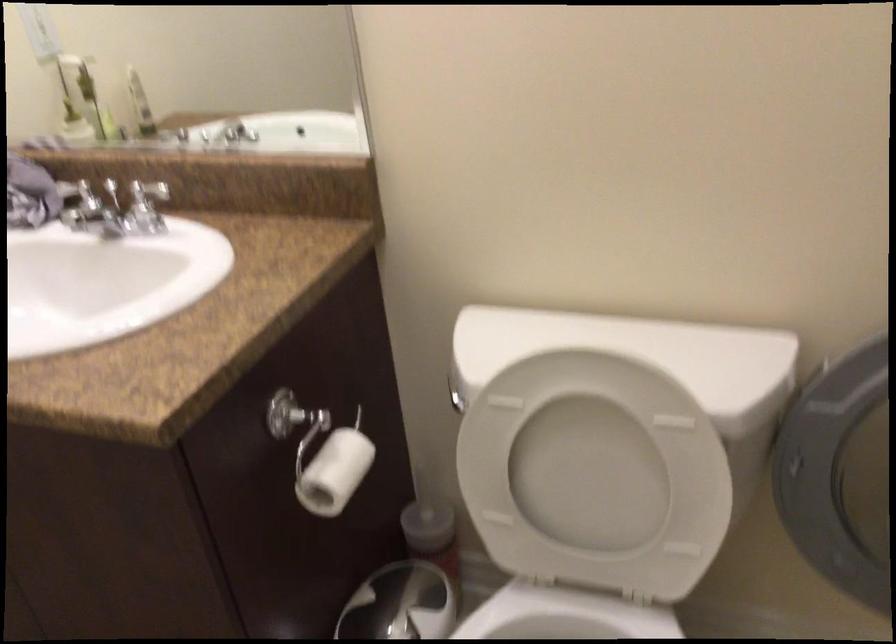
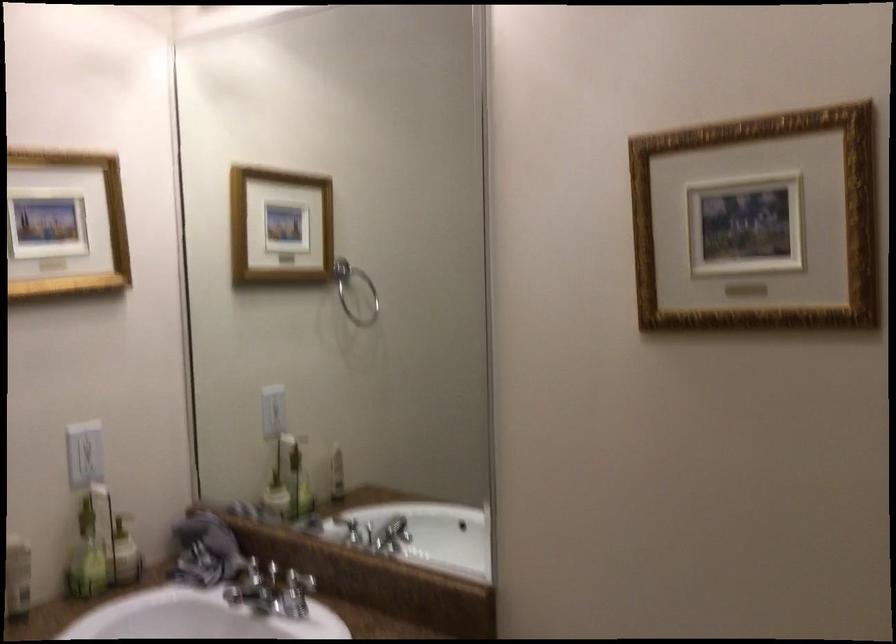
The first image is from the beginning of the video and the second image is from the end. How did the camera likely rotate when shooting the video?

The camera rotated toward left-up.